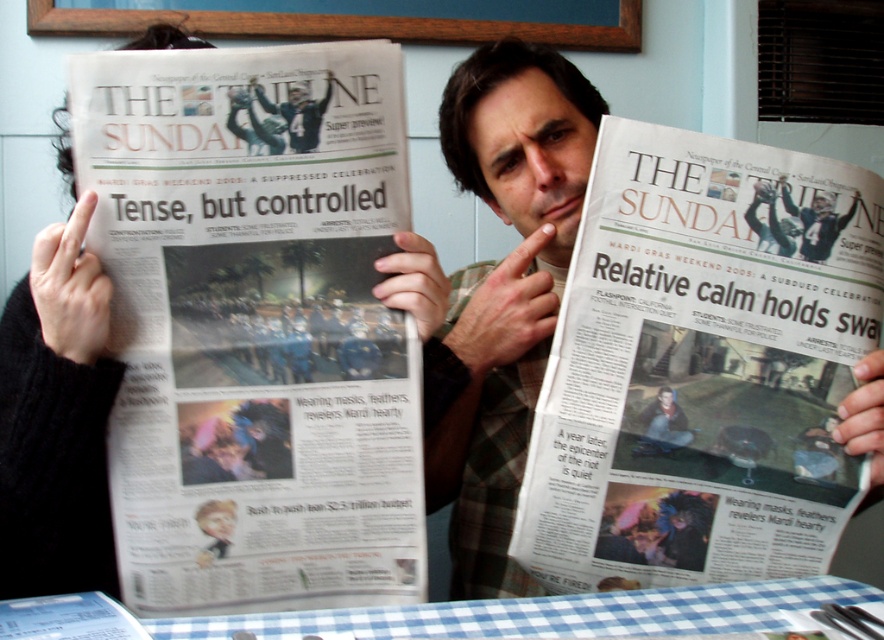
Question: In this image, where is white paper newspaper at left located relative to white paper newspaper at center?

Choices:
 (A) left
 (B) right

Answer: (A)

Question: Observing the image, what is the correct spatial positioning of white paper newspaper at left in reference to matte black jersey at upper right?

Choices:
 (A) right
 (B) left

Answer: (B)

Question: Considering the real-world distances, which object is closest to the blue checkered tablecloth at lower center?

Choices:
 (A) matte black jersey at upper right
 (B) white paper newspaper at left
 (C) white paper newspaper at center

Answer: (C)

Question: Which point is closer to the camera?

Choices:
 (A) (354, 118)
 (B) (581, 618)
 (C) (568, 592)
 (D) (809, 209)

Answer: (B)

Question: Which object appears farthest from the camera in this image?

Choices:
 (A) blue checkered tablecloth at lower center
 (B) white paper newspaper at left
 (C) matte black jersey at upper right
 (D) white paper newspaper at center

Answer: (C)

Question: Does white paper newspaper at center have a smaller size compared to matte black jersey at upper right?

Choices:
 (A) yes
 (B) no

Answer: (B)